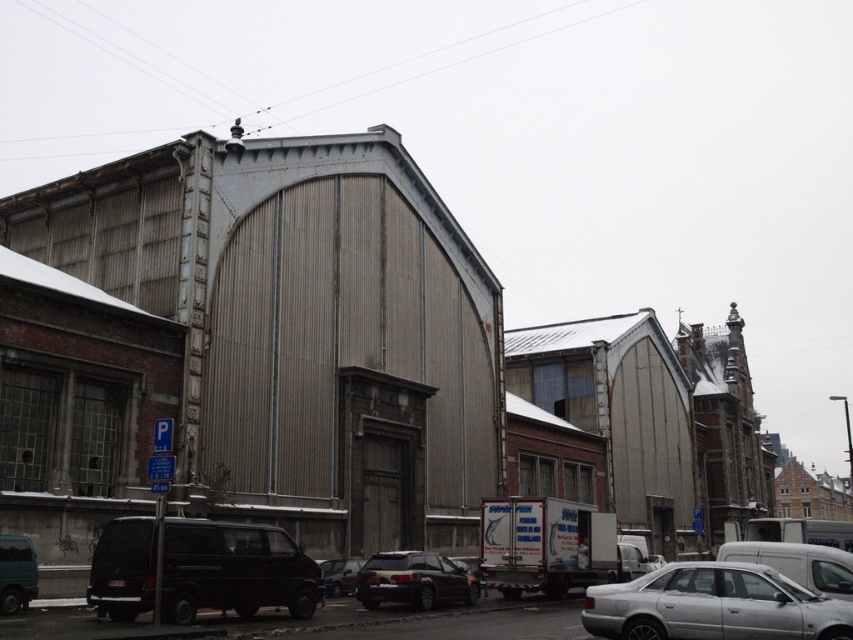
You are a delivery driver who needs to park your vehicle in this parking area. You see the white matte van at right and the shiny black sedan at center. Which vehicle is positioned closer to the entrance of the parking area?

The white matte van at right is closer to the viewer than the shiny black sedan at center, so it is positioned closer to the entrance of the parking area.

You are a delivery driver trying to navigate through the parking area in the scene. You need to move from the point at coordinates point (753,524) to the point at coordinates point (326,582). Based on the spatial relationship between these two points, which direction should you move to reach your destination?

Point (753,524) is in front of point (326,582), so you should move backward to reach point (326,582) from point (753,524).

You are a delivery driver who needs to park your vehicle in this parking area. You have a vehicle that is the same size as the shiny black sedan at center. There is a spot next to the white matte van at right. Will your vehicle fit in the space if you park there?

The white matte van at right is larger than the shiny black sedan at center. Since the parking space next to the white matte van at right is likely sized for vehicles of its size, your vehicle, which is the same size as the smaller shiny black sedan at center, should fit comfortably in that space.